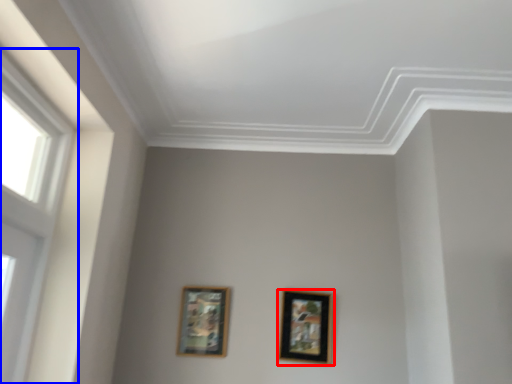
Question: Which point is closer to the camera, picture frame (highlighted by a red box) or window (highlighted by a blue box)?

Choices:
 (A) picture frame
 (B) window

Answer: (B)